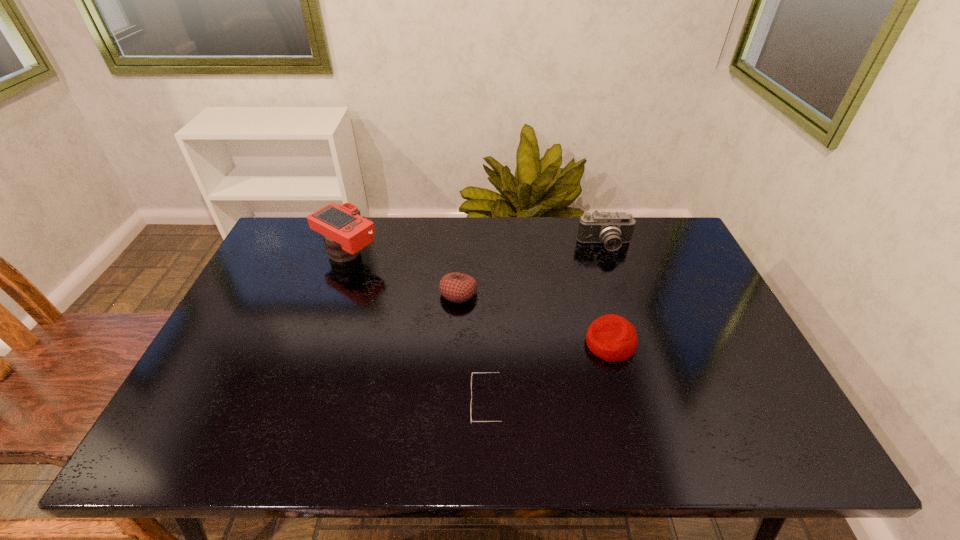
Identify the location of free space located 0.100m on the left of the leftmost object. pos(285,255).

Image resolution: width=960 pixels, height=540 pixels. Find the location of `free region located on the front-facing side of the right camera`. free region located on the front-facing side of the right camera is located at coordinates (638, 343).

At what (x,y) coordinates should I click in order to perform the action: click on vacant area situated on the seat area of the nearer beanbag. Please return your answer as a coordinate pair (x, y). Looking at the image, I should click on (462, 343).

Locate an element on the screen. The image size is (960, 540). free space located on the seat area of the nearer beanbag is located at coordinates (493, 343).

Find the location of a particular element. The width and height of the screenshot is (960, 540). blank space located 0.220m on the seat area of the nearer beanbag is located at coordinates (501, 343).

Locate an element on the screen. This screenshot has width=960, height=540. free space located on the left of the farther beanbag is located at coordinates (398, 293).

This screenshot has height=540, width=960. I want to click on vacant region located on the front-facing side of the shortest object, so click(x=449, y=404).

The image size is (960, 540). In order to click on free region located on the front-facing side of the shortest object in this screenshot , I will do `click(331, 404)`.

Where is `vacant area situated 0.240m on the front-facing side of the shortest object`? The image size is (960, 540). vacant area situated 0.240m on the front-facing side of the shortest object is located at coordinates click(366, 404).

The height and width of the screenshot is (540, 960). In order to click on object at the near edge in this screenshot , I will do `click(500, 372)`.